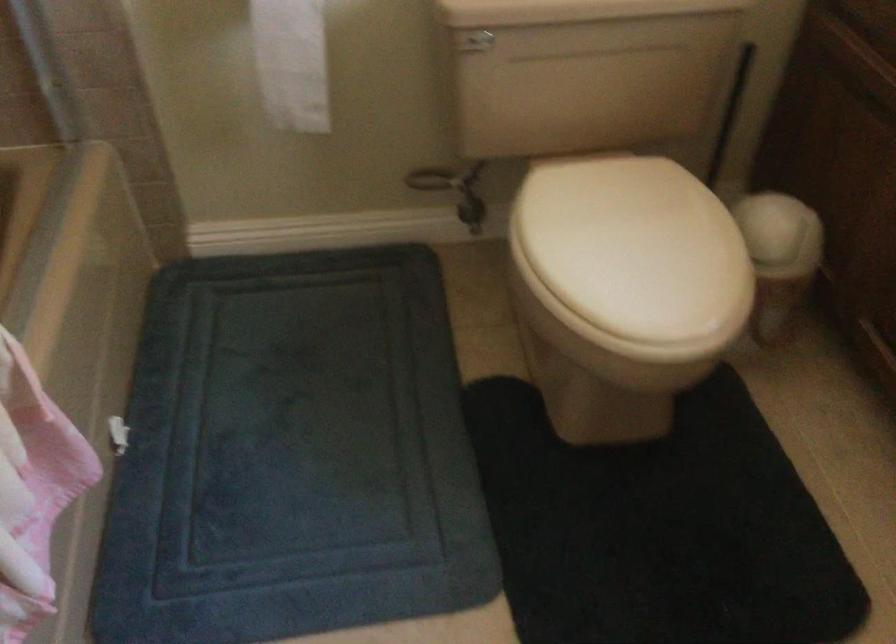
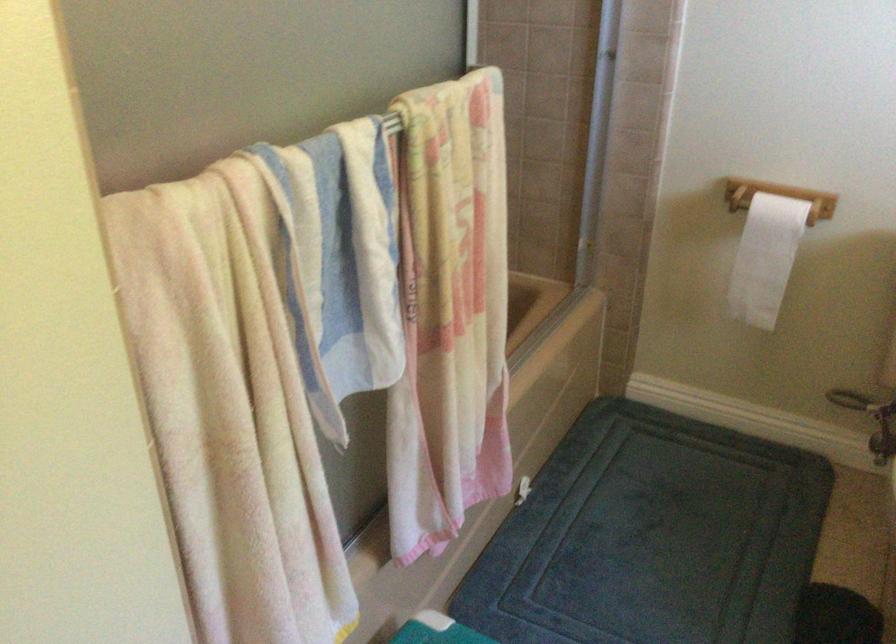
Locate, in the second image, the point that corresponds to point 452,199 in the first image.

(871, 420)